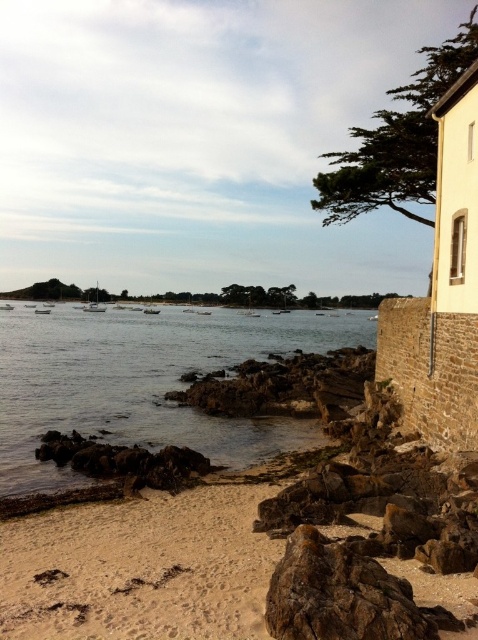
You are standing on the beach and want to reach the point marked as point (227, 433). If your walking speed is 3 feet per second, how many seconds will it take you to reach that point?

The distance between you and point (227, 433) is 74.82 feet. At a speed of 3 feet per second, dividing 74.82 by 3 gives approximately 24.94 seconds. Therefore, it will take roughly 25 seconds to reach the point.